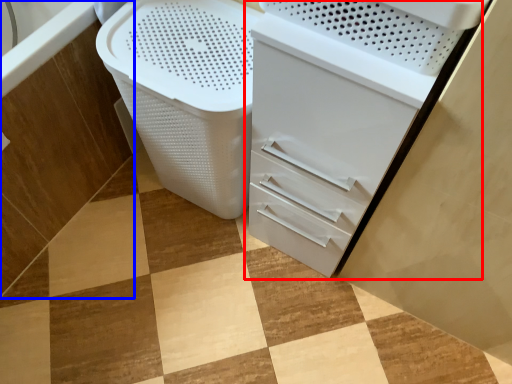
Question: Which object is closer to the camera taking this photo, file cabinet (highlighted by a red box) or bath (highlighted by a blue box)?

Choices:
 (A) file cabinet
 (B) bath

Answer: (A)